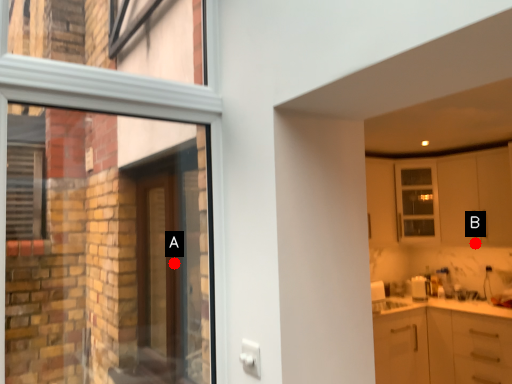
Question: Two points are circled on the image, labeled by A and B beside each circle. Which point is farther from the camera taking this photo?

Choices:
 (A) A is further
 (B) B is further

Answer: (B)